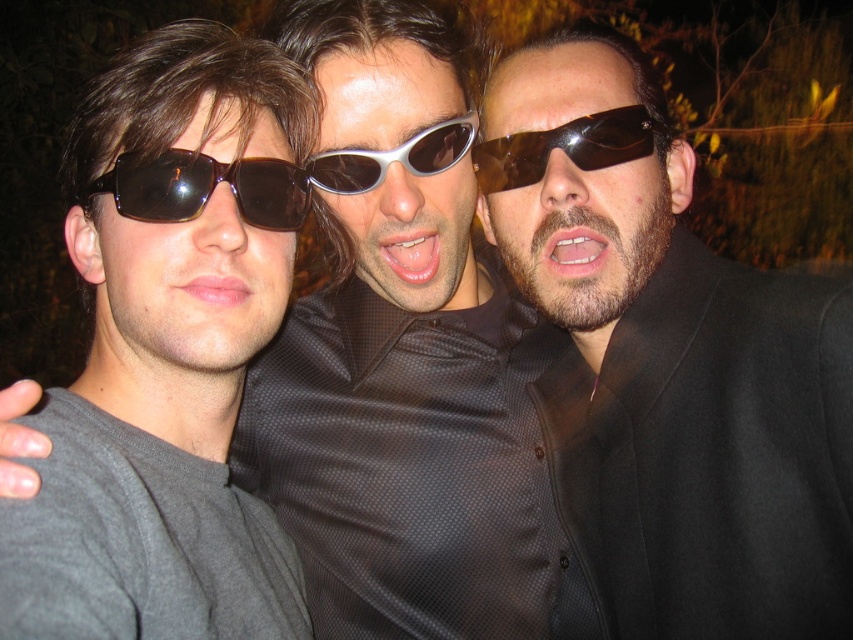
Question: Does matte brown sunglasses at left have a greater width compared to brown matte sunglasses at center?

Choices:
 (A) no
 (B) yes

Answer: (A)

Question: Can you confirm if matte black suit at center is wider than brown matte sunglasses at center?

Choices:
 (A) yes
 (B) no

Answer: (A)

Question: Which point is closer to the camera?

Choices:
 (A) click(653, 323)
 (B) click(575, 122)
 (C) click(280, 166)
 (D) click(88, 390)

Answer: (D)

Question: Considering the real-world distances, which object is farthest from the brown matte sunglasses at center?

Choices:
 (A) matte black sunglasses at left
 (B) silver metallic sunglasses at center

Answer: (A)

Question: Which point is closer to the camera?

Choices:
 (A) (169, 522)
 (B) (227, 179)
 (C) (329, 154)
 (D) (560, 316)

Answer: (A)

Question: Does matte black suit at center appear on the left side of silver metallic sunglasses at center?

Choices:
 (A) no
 (B) yes

Answer: (A)